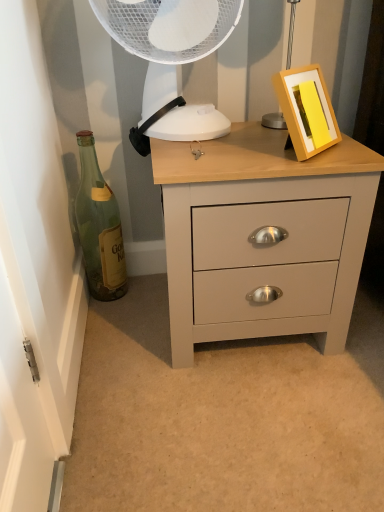
Question: From a real-world perspective, is matte gray chest of drawers at center on top of white plastic mechanical fan at upper center?

Choices:
 (A) yes
 (B) no

Answer: (B)

Question: Considering the relative positions of matte gray chest of drawers at center and white plastic mechanical fan at upper center in the image provided, is matte gray chest of drawers at center behind white plastic mechanical fan at upper center?

Choices:
 (A) no
 (B) yes

Answer: (A)

Question: Is matte gray chest of drawers at center in front of white plastic mechanical fan at upper center?

Choices:
 (A) no
 (B) yes

Answer: (B)

Question: Is matte gray chest of drawers at center bigger than white plastic mechanical fan at upper center?

Choices:
 (A) no
 (B) yes

Answer: (B)

Question: From a real-world perspective, is matte gray chest of drawers at center positioned under white plastic mechanical fan at upper center based on gravity?

Choices:
 (A) yes
 (B) no

Answer: (A)

Question: Is matte gray chest of drawers at center wider or thinner than white plastic mechanical fan at upper center?

Choices:
 (A) thin
 (B) wide

Answer: (B)

Question: From a real-world perspective, is matte gray chest of drawers at center above or below white plastic mechanical fan at upper center?

Choices:
 (A) above
 (B) below

Answer: (B)

Question: Would you say matte gray chest of drawers at center is to the left or to the right of white plastic mechanical fan at upper center in the picture?

Choices:
 (A) right
 (B) left

Answer: (A)

Question: Considering the positions of matte gray chest of drawers at center and white plastic mechanical fan at upper center in the image, is matte gray chest of drawers at center taller or shorter than white plastic mechanical fan at upper center?

Choices:
 (A) tall
 (B) short

Answer: (A)

Question: In terms of size, does green glass bottle at left appear bigger or smaller than white plastic mechanical fan at upper center?

Choices:
 (A) small
 (B) big

Answer: (A)

Question: In terms of height, does green glass bottle at left look taller or shorter compared to white plastic mechanical fan at upper center?

Choices:
 (A) tall
 (B) short

Answer: (A)

Question: Is green glass bottle at left spatially inside white plastic mechanical fan at upper center, or outside of it?

Choices:
 (A) inside
 (B) outside

Answer: (B)

Question: From the image's perspective, is green glass bottle at left above or below white plastic mechanical fan at upper center?

Choices:
 (A) below
 (B) above

Answer: (A)

Question: Looking at the image, does white plastic mechanical fan at upper center seem bigger or smaller compared to matte gray chest of drawers at center?

Choices:
 (A) small
 (B) big

Answer: (A)

Question: Is white plastic mechanical fan at upper center in front of or behind matte gray chest of drawers at center in the image?

Choices:
 (A) behind
 (B) front

Answer: (A)